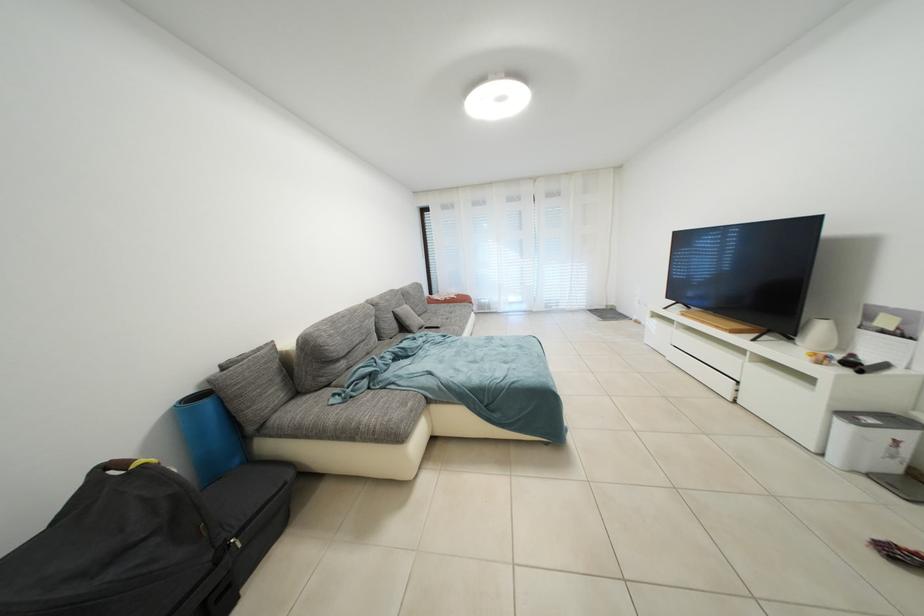
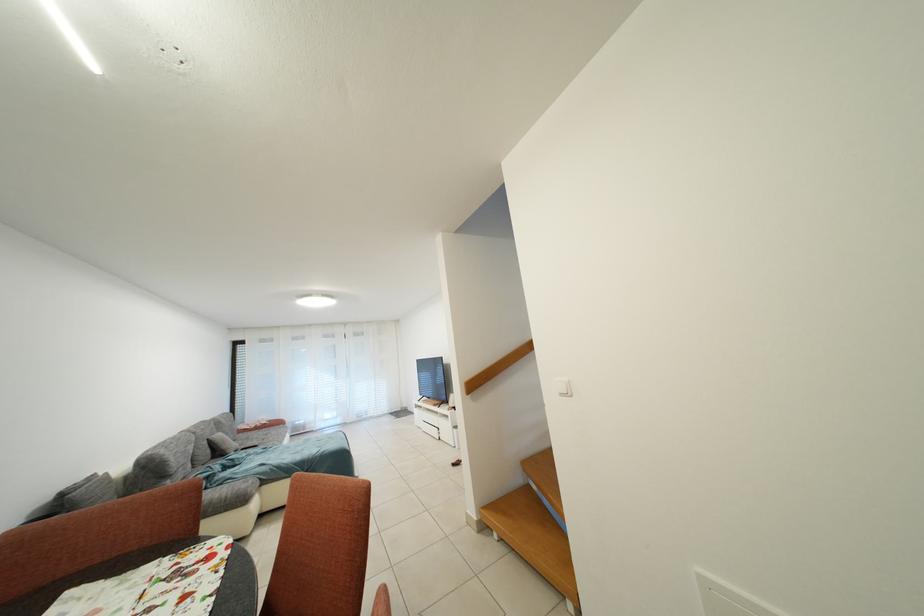
The point at (411, 331) is marked in the first image. Where is the corresponding point in the second image?

(226, 456)